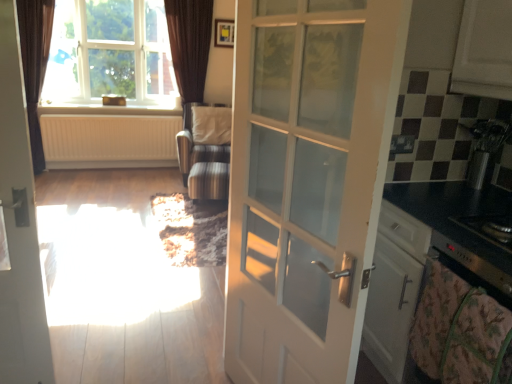
Find the location of a particular element. The height and width of the screenshot is (384, 512). free space in front of white matte radiator at upper left is located at coordinates [89, 182].